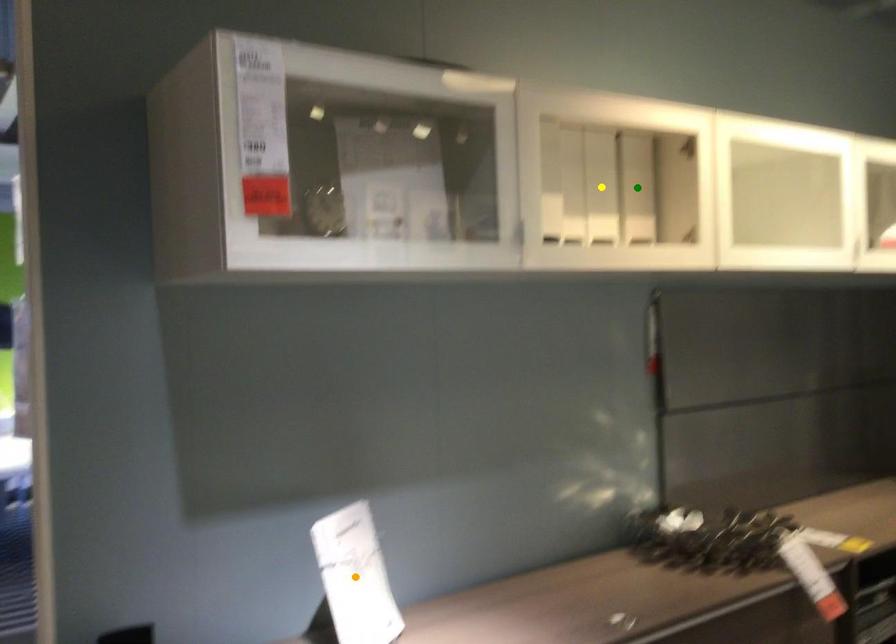
Order these from nearest to farthest:
green point | yellow point | orange point

orange point, yellow point, green point